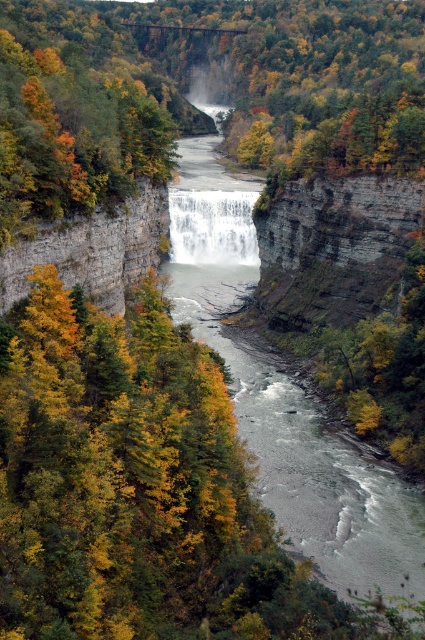
Question: Which object appears closest to the camera in this image?

Choices:
 (A) rustic stone cliff at left
 (B) autumn leaves at center
 (C) white textured water at center

Answer: (A)

Question: Which of the following is the closest to the observer?

Choices:
 (A) white textured water at center
 (B) autumn leaves at center

Answer: (B)

Question: Which point is farther to the camera?

Choices:
 (A) click(x=302, y=452)
 (B) click(x=74, y=275)
 (C) click(x=19, y=104)

Answer: (A)

Question: Is gray smooth river at center positioned at the back of autumn leaves at center?

Choices:
 (A) yes
 (B) no

Answer: (B)

Question: From the image, what is the correct spatial relationship of gray smooth river at center in relation to autumn leaves at center?

Choices:
 (A) right
 (B) left

Answer: (A)

Question: Where is autumn leaves at center located in relation to white textured water at center in the image?

Choices:
 (A) above
 (B) below

Answer: (A)